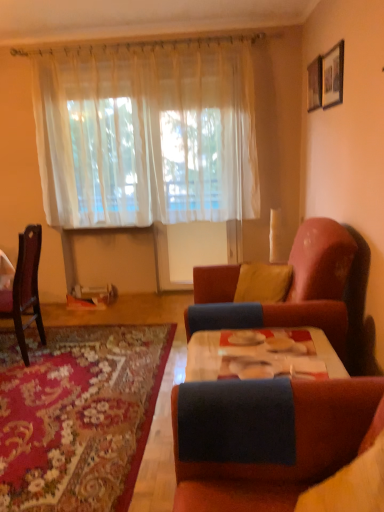
Question: Is sheer white curtain at upper center facing away from yellow fabric pillow at center?

Choices:
 (A) no
 (B) yes

Answer: (A)

Question: Does sheer white curtain at upper center have a smaller size compared to yellow fabric pillow at center?

Choices:
 (A) yes
 (B) no

Answer: (B)

Question: Can you confirm if sheer white curtain at upper center is thinner than yellow fabric pillow at center?

Choices:
 (A) yes
 (B) no

Answer: (A)

Question: Considering the relative sizes of sheer white curtain at upper center and yellow fabric pillow at center in the image provided, is sheer white curtain at upper center bigger than yellow fabric pillow at center?

Choices:
 (A) no
 (B) yes

Answer: (B)

Question: Does sheer white curtain at upper center have a greater height compared to yellow fabric pillow at center?

Choices:
 (A) no
 (B) yes

Answer: (B)

Question: In terms of size, does sheer white curtain at upper center appear bigger or smaller than wooden picture frame at upper right, placed as the 1th picture frame when sorted from back to front?

Choices:
 (A) big
 (B) small

Answer: (A)

Question: Considering the relative positions of sheer white curtain at upper center and wooden picture frame at upper right, placed as the 1th picture frame when sorted from back to front, in the image provided, is sheer white curtain at upper center to the left or to the right of wooden picture frame at upper right, placed as the 1th picture frame when sorted from back to front,?

Choices:
 (A) left
 (B) right

Answer: (A)

Question: From a real-world perspective, is sheer white curtain at upper center above or below wooden picture frame at upper right, which appears as the second picture frame when viewed from the front?

Choices:
 (A) below
 (B) above

Answer: (A)

Question: Is sheer white curtain at upper center taller or shorter than wooden picture frame at upper right, placed as the 1th picture frame when sorted from back to front?

Choices:
 (A) short
 (B) tall

Answer: (B)

Question: Is wooden picture frame at upper right, arranged as the first picture frame when viewed from the front, wider or thinner than carpeted rug at lower left?

Choices:
 (A) thin
 (B) wide

Answer: (A)

Question: Which is correct: wooden picture frame at upper right, acting as the 2th picture frame starting from the back, is inside carpeted rug at lower left, or outside of it?

Choices:
 (A) outside
 (B) inside

Answer: (A)

Question: Is wooden picture frame at upper right, arranged as the first picture frame when viewed from the front, in front of or behind carpeted rug at lower left in the image?

Choices:
 (A) behind
 (B) front

Answer: (A)

Question: From the image's perspective, relative to carpeted rug at lower left, is wooden picture frame at upper right, arranged as the first picture frame when viewed from the front, above or below?

Choices:
 (A) below
 (B) above

Answer: (B)

Question: Considering the positions of dark wood chair at left and wooden picture frame at upper right, acting as the 2th picture frame starting from the back, in the image, is dark wood chair at left bigger or smaller than wooden picture frame at upper right, acting as the 2th picture frame starting from the back,?

Choices:
 (A) small
 (B) big

Answer: (B)

Question: In the image, is dark wood chair at left positioned in front of or behind wooden picture frame at upper right, acting as the 2th picture frame starting from the back?

Choices:
 (A) front
 (B) behind

Answer: (B)